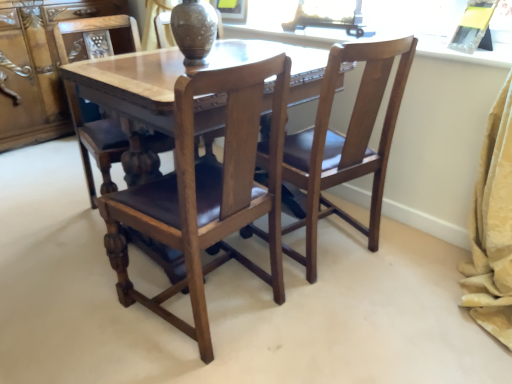
Locate an element on the screen. Image resolution: width=512 pixels, height=384 pixels. brown leather chair at center, which is counted as the first chair, starting from the left is located at coordinates (116, 147).

Image resolution: width=512 pixels, height=384 pixels. What are the coordinates of `wooden polished table at center` in the screenshot? It's located at (133, 84).

The height and width of the screenshot is (384, 512). Identify the location of polished wood chair at center, the 2th chair positioned from the left. (207, 193).

What are the coordinates of `wooden chair at center, which appears as the first chair when viewed from the right` in the screenshot? It's located at pyautogui.click(x=346, y=142).

From the picture: Does wooden polished table at center appear on the right side of wooden cabinet at left?

Yes, wooden polished table at center is to the right of wooden cabinet at left.

Considering the sizes of objects wooden polished table at center and wooden cabinet at left in the image provided, who is bigger, wooden polished table at center or wooden cabinet at left?

Bigger between the two is wooden polished table at center.

From a real-world perspective, is wooden polished table at center located higher than wooden cabinet at left?

No, from a real-world perspective, wooden polished table at center is not over wooden cabinet at left

Can wooden cabinet at left be found inside wooden polished table at center?

Definitely not — wooden cabinet at left is not inside wooden polished table at center.

How many degrees apart are the facing directions of wooden chair at center, which appears as the third chair when viewed from the left, and brown leather chair at center, which is counted as the first chair, starting from the left?

177 degrees.

From a real-world perspective, is wooden chair at center, which appears as the third chair when viewed from the left, on brown leather chair at center, positioned as the 3th chair in right-to-left order?

No, from a real-world perspective, wooden chair at center, which appears as the third chair when viewed from the left, is not on top of brown leather chair at center, positioned as the 3th chair in right-to-left order.

Is brown leather chair at center, positioned as the 3th chair in right-to-left order, at the back of wooden chair at center, which appears as the third chair when viewed from the left?

wooden chair at center, which appears as the third chair when viewed from the left, is not turned away from brown leather chair at center, positioned as the 3th chair in right-to-left order.

Considering the positions of objects wooden chair at center, which appears as the first chair when viewed from the right, and brown leather chair at center, which is counted as the first chair, starting from the left, in the image provided, who is in front, wooden chair at center, which appears as the first chair when viewed from the right, or brown leather chair at center, which is counted as the first chair, starting from the left,?

wooden chair at center, which appears as the first chair when viewed from the right, is closer to the camera.

Considering the relative sizes of brown matte vase at center and wooden polished table at center in the image provided, is brown matte vase at center shorter than wooden polished table at center?

Yes, brown matte vase at center is shorter than wooden polished table at center.

Considering their positions, is brown matte vase at center located in front of or behind wooden polished table at center?

brown matte vase at center is behind wooden polished table at center.

Does brown matte vase at center contain wooden polished table at center?

Actually, wooden polished table at center is outside brown matte vase at center.

Can you confirm if brown matte vase at center is positioned to the left of wooden polished table at center?

Indeed, brown matte vase at center is positioned on the left side of wooden polished table at center.

Which is more to the right, polished wood chair at center, the 2th chair when ordered from right to left, or wooden chair at center, which appears as the third chair when viewed from the left?

Positioned to the right is wooden chair at center, which appears as the third chair when viewed from the left.

From a real-world perspective, who is located lower, polished wood chair at center, the 2th chair positioned from the left, or wooden chair at center, which appears as the third chair when viewed from the left?

In real-world perspective, wooden chair at center, which appears as the third chair when viewed from the left, is lower.

Is polished wood chair at center, the 2th chair positioned from the left, not near wooden chair at center, which appears as the third chair when viewed from the left?

No.

How many degrees apart are the facing directions of polished wood chair at center, the 2th chair when ordered from right to left, and wooden chair at center, which appears as the first chair when viewed from the right?

They differ by 14.8 degrees in their facing directions.

From the image's perspective, who appears lower, wooden chair at center, which appears as the first chair when viewed from the right, or wooden polished table at center?

wooden chair at center, which appears as the first chair when viewed from the right, is shown below in the image.

Consider the image. Who is smaller, wooden chair at center, which appears as the third chair when viewed from the left, or wooden polished table at center?

With smaller size is wooden chair at center, which appears as the third chair when viewed from the left.

Does wooden chair at center, which appears as the third chair when viewed from the left, have a lesser width compared to wooden polished table at center?

Indeed, wooden chair at center, which appears as the third chair when viewed from the left, has a lesser width compared to wooden polished table at center.

I want to click on round table on the left of wooden chair at center, which appears as the third chair when viewed from the left, so click(x=133, y=84).

Is brown leather chair at center, which is counted as the first chair, starting from the left, wider or thinner than wooden cabinet at left?

brown leather chair at center, which is counted as the first chair, starting from the left, is thinner than wooden cabinet at left.

Would you consider brown leather chair at center, positioned as the 3th chair in right-to-left order, to be distant from wooden cabinet at left?

Actually, brown leather chair at center, positioned as the 3th chair in right-to-left order, and wooden cabinet at left are a little close together.

Considering the relative positions of brown leather chair at center, positioned as the 3th chair in right-to-left order, and wooden cabinet at left in the image provided, is brown leather chair at center, positioned as the 3th chair in right-to-left order, to the left of wooden cabinet at left from the viewer's perspective?

No.

Based on the photo, from the image's perspective, which object appears higher, brown leather chair at center, positioned as the 3th chair in right-to-left order, or wooden cabinet at left?

wooden cabinet at left, from the image's perspective.

Find the location of a particular element. the 2nd chair below the brown matte vase at center (from the image's perspective) is located at coordinates (346, 142).

Could you measure the distance between brown matte vase at center and wooden chair at center, which appears as the first chair when viewed from the right?

brown matte vase at center is 25.03 inches away from wooden chair at center, which appears as the first chair when viewed from the right.

Can you confirm if brown matte vase at center is positioned to the right of wooden chair at center, which appears as the third chair when viewed from the left?

In fact, brown matte vase at center is to the left of wooden chair at center, which appears as the third chair when viewed from the left.

Does brown matte vase at center have a greater height compared to wooden chair at center, which appears as the third chair when viewed from the left?

No, brown matte vase at center is not taller than wooden chair at center, which appears as the third chair when viewed from the left.

The width and height of the screenshot is (512, 384). I want to click on cabinetry above the wooden polished table at center (from the image's perspective), so [37, 67].

Identify the location of chair that is the 1st one when counting downward from the brown leather chair at center, which is counted as the first chair, starting from the left (from the image's perspective). This screenshot has width=512, height=384. (346, 142).

Based on their spatial positions, is polished wood chair at center, the 2th chair when ordered from right to left, or wooden polished table at center closer to brown leather chair at center, which is counted as the first chair, starting from the left?

The object closer to brown leather chair at center, which is counted as the first chair, starting from the left, is wooden polished table at center.

Considering their positions, is wooden cabinet at left positioned further to polished wood chair at center, the 2th chair when ordered from right to left, than wooden polished table at center?

wooden cabinet at left lies further to polished wood chair at center, the 2th chair when ordered from right to left, than the other object.

Based on their spatial positions, is wooden chair at center, which appears as the first chair when viewed from the right, or wooden cabinet at left closer to brown leather chair at center, positioned as the 3th chair in right-to-left order?

The object closer to brown leather chair at center, positioned as the 3th chair in right-to-left order, is wooden chair at center, which appears as the first chair when viewed from the right.

From the image, which object appears to be farther from wooden chair at center, which appears as the third chair when viewed from the left, brown matte vase at center or wooden polished table at center?

brown matte vase at center.

Considering their positions, is polished wood chair at center, the 2th chair positioned from the left, positioned further to wooden polished table at center than wooden cabinet at left?

wooden cabinet at left is positioned further to the anchor wooden polished table at center.

Estimate the real-world distances between objects in this image. Which object is closer to brown matte vase at center, wooden chair at center, which appears as the third chair when viewed from the left, or wooden polished table at center?

Among the two, wooden polished table at center is located nearer to brown matte vase at center.

Which object lies further to the anchor point polished wood chair at center, the 2th chair positioned from the left, wooden polished table at center or wooden chair at center, which appears as the third chair when viewed from the left?

wooden chair at center, which appears as the third chair when viewed from the left, is positioned further to the anchor polished wood chair at center, the 2th chair positioned from the left.

When comparing their distances from wooden polished table at center, does wooden chair at center, which appears as the first chair when viewed from the right, or wooden cabinet at left seem closer?

wooden chair at center, which appears as the first chair when viewed from the right, is positioned closer to the anchor wooden polished table at center.

Locate an element on the screen. The image size is (512, 384). round table between polished wood chair at center, the 2th chair positioned from the left, and brown leather chair at center, positioned as the 3th chair in right-to-left order, from front to back is located at coordinates (133, 84).

Locate an element on the screen. The image size is (512, 384). glass vase between polished wood chair at center, the 2th chair when ordered from right to left, and wooden cabinet at left in the front-back direction is located at coordinates (194, 30).

I want to click on round table between brown matte vase at center and wooden chair at center, which appears as the first chair when viewed from the right, so click(x=133, y=84).

Find the location of a particular element. glass vase between wooden cabinet at left and wooden chair at center, which appears as the third chair when viewed from the left is located at coordinates (194, 30).